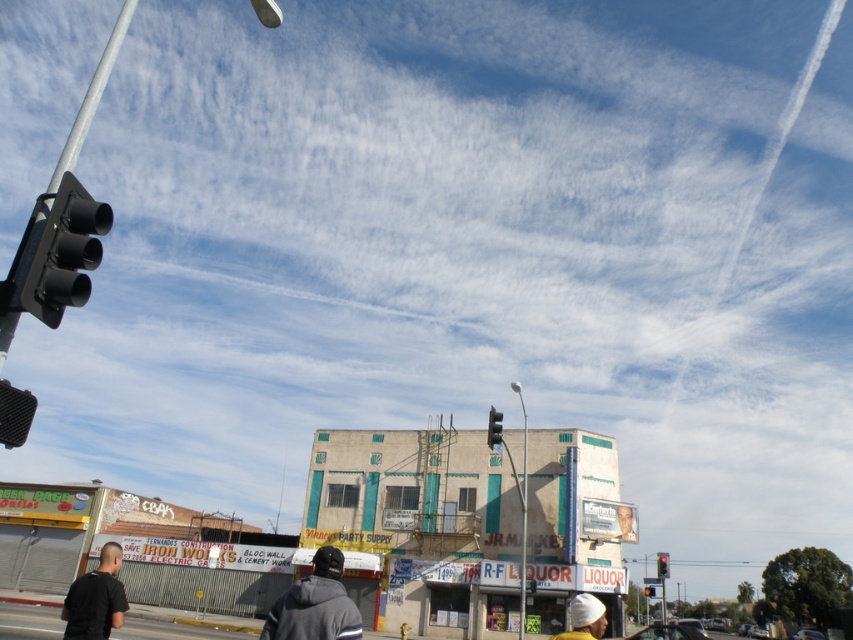
You are standing on the street looking up at the scene. Which object is closer to the left edge of the photo, the matte black traffic light at left or the dark gray hoodie at center?

The matte black traffic light at left is positioned on the left side of the dark gray hoodie at center, so it is closer to the left edge of the photo.

You are a photographer trying to capture both the dark gray hoodie at center and the dark gray hoodie at lower left in a single frame. Which hoodie should you focus on to ensure both fit in the photo without cropping?

The dark gray hoodie at center is wider than the dark gray hoodie at lower left, so focusing on the dark gray hoodie at center will ensure both fit in the photo without cropping.